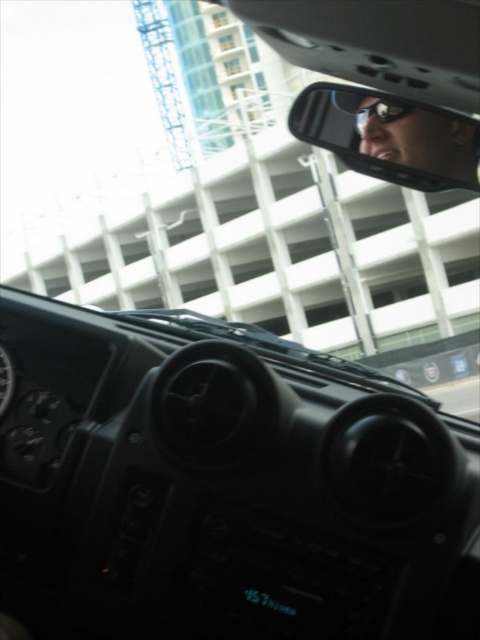
You are sitting in the driver seat of the car shown in the image. You want to adjust the clear plastic rearview mirror at upper center to get a better view of the parking structure. Considering its current position, can you reach it without leaving your seat?

The clear plastic rearview mirror at upper center is 1.59 meters away from viewer, so yes, you can reach it without leaving your seat since it is within a typical arm reach distance.

Consider the image. You are driving a car and need to check both the clear plastic rearview mirror at upper center and the matte black goggles at upper center. Which object is bigger in size?

The clear plastic rearview mirror at upper center is bigger in size compared to the matte black goggles at upper center.

You are sitting in the driver seat of the vehicle. You notice two points marked on the windshield. The first point is at coordinates point (x=295, y=100) and the second point is at point (x=406, y=106). Which point is closer to you?

Point (x=295, y=100) is behind point (x=406, y=106), so the point closer to you is point (x=406, y=106).